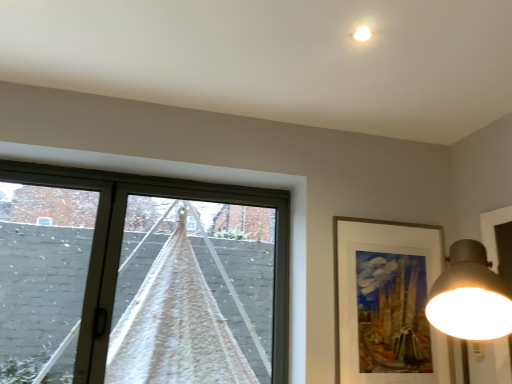
Question: Considering their positions, is gold-framed artwork at upper right located in front of or behind white textured curtain at left?

Choices:
 (A) behind
 (B) front

Answer: (A)

Question: Considering the relative positions of gold-framed artwork at upper right and white textured curtain at left in the image provided, is gold-framed artwork at upper right to the left or to the right of white textured curtain at left?

Choices:
 (A) right
 (B) left

Answer: (A)

Question: From the image's perspective, is gold-framed artwork at upper right located above or below white textured curtain at left?

Choices:
 (A) above
 (B) below

Answer: (B)

Question: Is white textured curtain at left wider or thinner than gold-framed artwork at upper right?

Choices:
 (A) thin
 (B) wide

Answer: (B)

Question: Considering the positions of white textured curtain at left and gold-framed artwork at upper right in the image, is white textured curtain at left bigger or smaller than gold-framed artwork at upper right?

Choices:
 (A) small
 (B) big

Answer: (B)

Question: Relative to gold-framed artwork at upper right, is white textured curtain at left in front or behind?

Choices:
 (A) front
 (B) behind

Answer: (A)

Question: From the image's perspective, relative to gold-framed artwork at upper right, is white textured curtain at left above or below?

Choices:
 (A) below
 (B) above

Answer: (B)